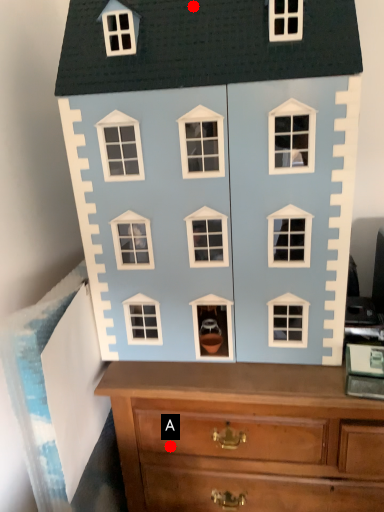
Question: Two points are circled on the image, labeled by A and B beside each circle. Which point is closer to the camera taking this photo?

Choices:
 (A) A is closer
 (B) B is closer

Answer: (B)